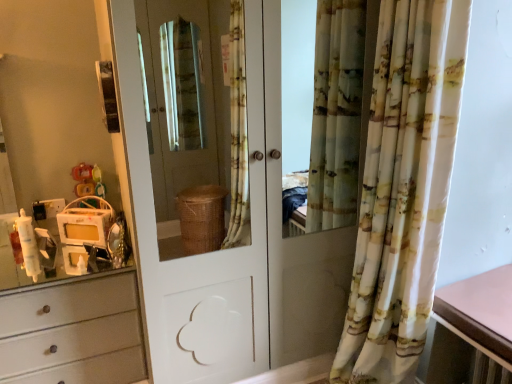
Question: Relative to plastic yellow toy at left, is printed fabric curtain at right in front or behind?

Choices:
 (A) front
 (B) behind

Answer: (A)

Question: Is point (387, 107) positioned closer to the camera than point (77, 180)?

Choices:
 (A) closer
 (B) farther

Answer: (A)

Question: Which object is positioned closest to the pink laminate table at right?

Choices:
 (A) plastic yellow toy at left
 (B) printed fabric curtain at right
 (C) white glossy door at center

Answer: (B)

Question: Which object is the farthest from the white glossy door at center?

Choices:
 (A) printed fabric curtain at right
 (B) plastic yellow toy at left
 (C) pink laminate table at right

Answer: (C)